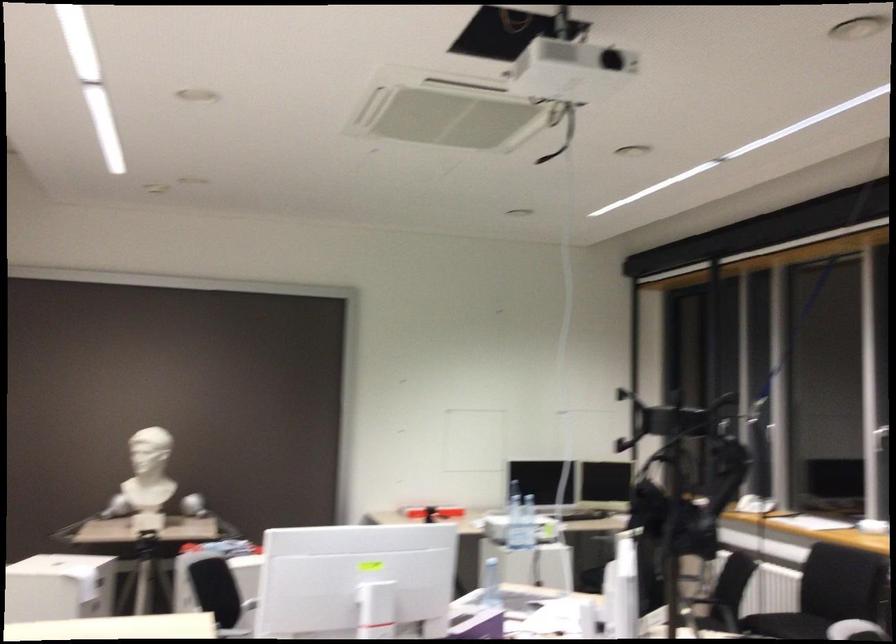
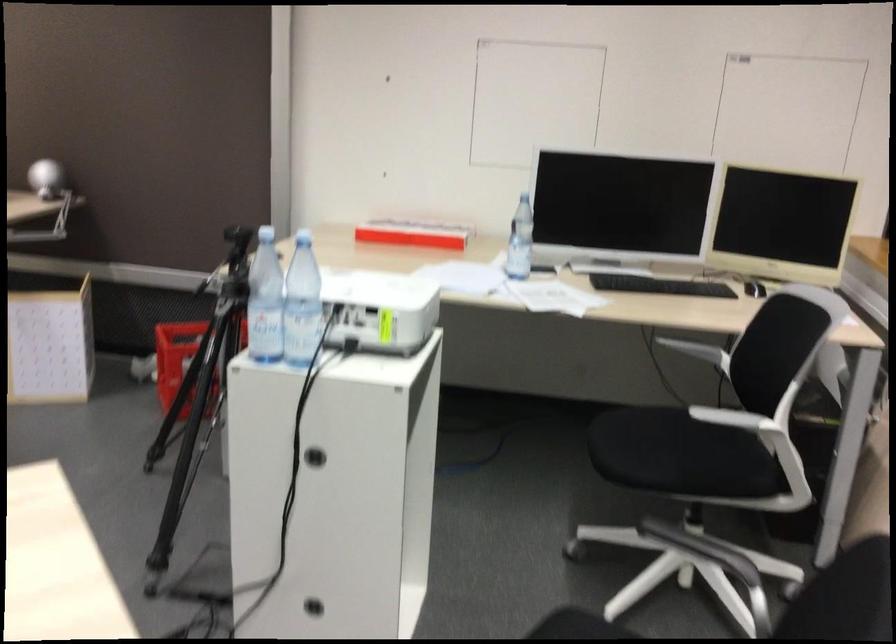
The point at (x=467, y=489) is marked in the first image. Where is the corresponding point in the second image?

(412, 234)